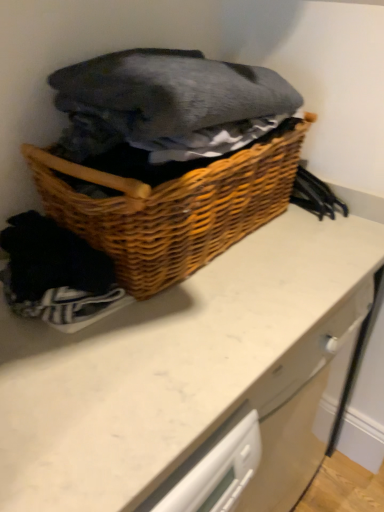
Question: Is woven wood basket at center bigger or smaller than dark gray cotton blanket at upper center?

Choices:
 (A) big
 (B) small

Answer: (A)

Question: Is woven wood basket at center wider or thinner than dark gray cotton blanket at upper center?

Choices:
 (A) wide
 (B) thin

Answer: (A)

Question: Estimate the real-world distances between objects in this image. Which object is farther from the white marble counter at center?

Choices:
 (A) dark gray cotton blanket at upper center
 (B) woven wood basket at center

Answer: (A)

Question: Which is nearer to the dark gray cotton blanket at upper center?

Choices:
 (A) white marble counter at center
 (B) woven wood basket at center

Answer: (B)